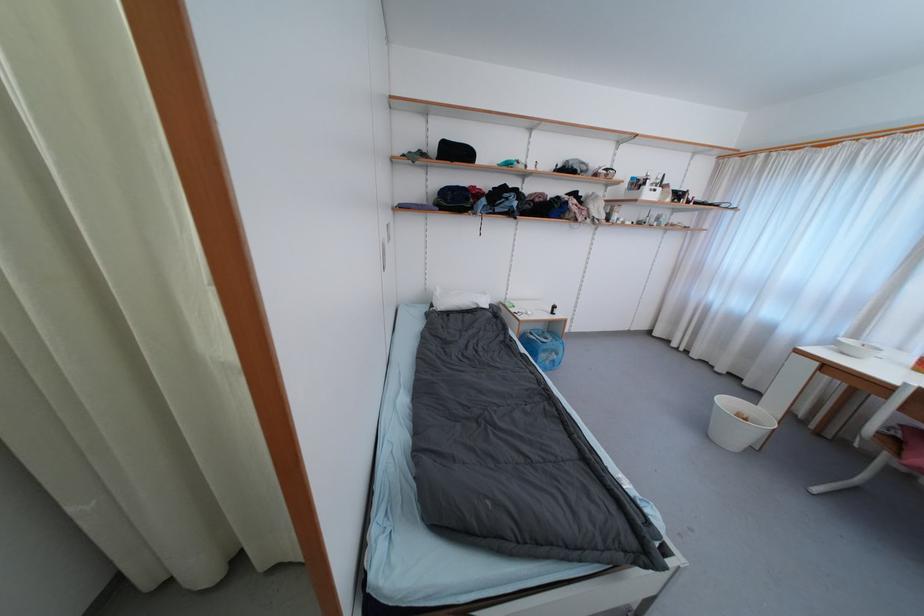
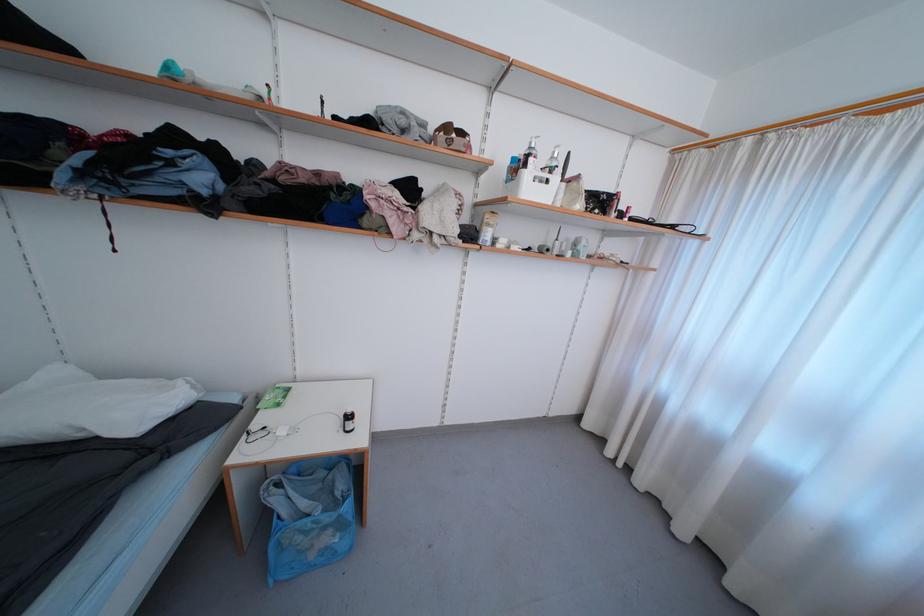
Where in the second image is the point corresponding to pixel 560 313 from the first image?

(354, 429)